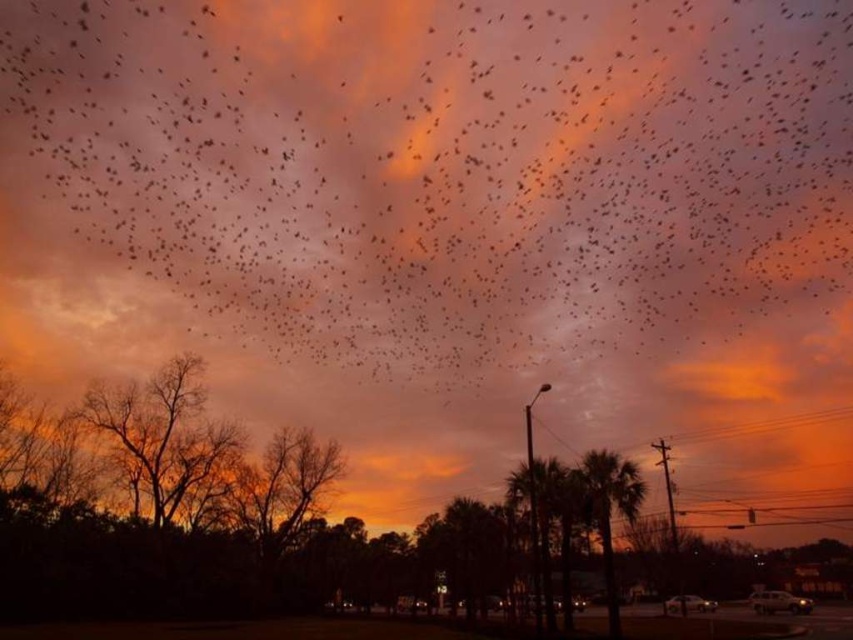
You are standing at point A at point (231,161) and want to walk to point B. The distance between them is 406.87 meters. If you walk at a speed of 3 meters per second, how many minutes will it take you to reach point B?

The distance between point A at point (231,161) and point B is 406.87 meters. At a walking speed of 3 meters per second, it would take approximately 135.62 seconds, which is about 2.26 minutes. Since the question asks for minutes, rounding to the nearest whole number gives approximately 2 minutes.

You are an ornithologist observing the scene. You notice the black matte birds at upper center and the brown leafless tree at left. Which object is located higher in the sky?

The black matte birds at upper center are positioned over the brown leafless tree at left, meaning they are higher in the sky.

You are a photographer standing at the center of the scene. You want to capture a photo where the brown leafless tree at left is positioned exactly at the lower left corner of the frame. Based on its current position, is this possible?

The brown leafless tree at left is located at point coordinates of (167, 440). To place it at the lower left corner, the photographer would need to adjust their position or framing to align the tree to the desired corner since its current coordinates are not at the corner.